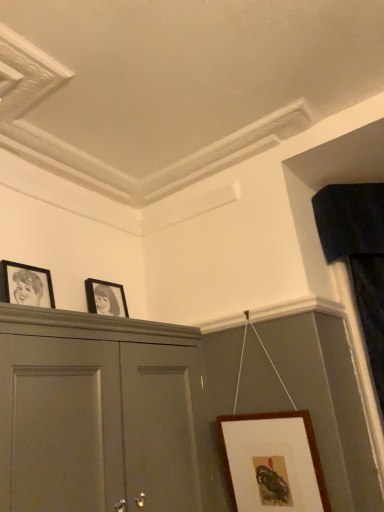
The height and width of the screenshot is (512, 384). I want to click on black matte picture frame at left, which ranks as the first picture frame in left-to-right order, so coord(27,285).

What do you see at coordinates (273, 462) in the screenshot? I see `brown wooden picture frame at lower right, which ranks as the 1th picture frame in bottom-to-top order` at bounding box center [273, 462].

Where is `black matte picture frame at left, which ranks as the third picture frame in bottom-to-top order`? black matte picture frame at left, which ranks as the third picture frame in bottom-to-top order is located at coordinates (27, 285).

Consider the image. How different are the orientations of velvet dark blue curtain at right and brown wooden picture frame at lower right, which ranks as the 1th picture frame in bottom-to-top order, in degrees?

They differ by 45 degrees in their facing directions.

Is velvet dark blue curtain at right outside of brown wooden picture frame at lower right, which ranks as the 1th picture frame in bottom-to-top order?

That's correct, velvet dark blue curtain at right is outside of brown wooden picture frame at lower right, which ranks as the 1th picture frame in bottom-to-top order.

From the image's perspective, which one is positioned lower, velvet dark blue curtain at right or brown wooden picture frame at lower right, the third picture frame when ordered from top to bottom?

brown wooden picture frame at lower right, the third picture frame when ordered from top to bottom, is shown below in the image.

Between velvet dark blue curtain at right and brown wooden picture frame at lower right, the third picture frame when ordered from top to bottom, which one has smaller size?

brown wooden picture frame at lower right, the third picture frame when ordered from top to bottom, is smaller.

Based on the photo, which object is positioned more to the left, brown wooden picture frame at lower right, which is the first picture frame in right-to-left order, or black matte picture frame at left, which ranks as the third picture frame in bottom-to-top order?

From the viewer's perspective, black matte picture frame at left, which ranks as the third picture frame in bottom-to-top order, appears more on the left side.

What are the coordinates of `the 2nd picture frame to the right of the black matte picture frame at left, placed as the 3th picture frame when sorted from right to left, counting from the anchor's position` in the screenshot? It's located at (273, 462).

Is brown wooden picture frame at lower right, which is the first picture frame in right-to-left order, touching black matte picture frame at left, which ranks as the first picture frame in left-to-right order?

They are not placed beside each other.

Is matte black picture frame at upper center, placed as the 2th picture frame when sorted from left to right, facing away from black matte picture frame at left, which ranks as the third picture frame in bottom-to-top order?

matte black picture frame at upper center, placed as the 2th picture frame when sorted from left to right, is not turned away from black matte picture frame at left, which ranks as the third picture frame in bottom-to-top order.

I want to click on picture frame above the matte black picture frame at upper center, the second picture frame from the top (from the image's perspective), so click(27, 285).

Is matte black picture frame at upper center, which is the 2th picture frame in bottom-to-top order, closer to the viewer compared to black matte picture frame at left, placed as the 3th picture frame when sorted from right to left?

That is False.

Does velvet dark blue curtain at right have a greater width compared to matte gray cabinet at upper left?

No.

Identify the location of cabinetry on the left side of velvet dark blue curtain at right. The height and width of the screenshot is (512, 384). (101, 415).

From the picture: Can you confirm if velvet dark blue curtain at right is positioned to the left of matte gray cabinet at upper left?

In fact, velvet dark blue curtain at right is to the right of matte gray cabinet at upper left.

Considering the points (124, 305) and (267, 479), which point is behind, point (124, 305) or point (267, 479)?

The point (124, 305) is behind.

Looking at this image, which of these two, matte black picture frame at upper center, the second picture frame from the top, or brown wooden picture frame at lower right, the third picture frame when ordered from top to bottom, stands taller?

Standing taller between the two is brown wooden picture frame at lower right, the third picture frame when ordered from top to bottom.

Who is bigger, matte black picture frame at upper center, which is counted as the 2th picture frame, starting from the right, or brown wooden picture frame at lower right, which is the first picture frame in right-to-left order?

brown wooden picture frame at lower right, which is the first picture frame in right-to-left order.

Considering the sizes of objects matte gray cabinet at upper left and matte black picture frame at upper center, the second picture frame from the top, in the image provided, who is wider, matte gray cabinet at upper left or matte black picture frame at upper center, the second picture frame from the top,?

Wider between the two is matte gray cabinet at upper left.

Considering the positions of points (37, 405) and (98, 290), is point (37, 405) farther from camera compared to point (98, 290)?

No, (37, 405) is in front of (98, 290).

In the scene shown: Choose the correct answer: Is matte gray cabinet at upper left inside matte black picture frame at upper center, the second picture frame from the top, or outside it?

matte gray cabinet at upper left is spatially situated outside matte black picture frame at upper center, the second picture frame from the top.

Is matte gray cabinet at upper left taller than matte black picture frame at upper center, placed as the 2th picture frame when sorted from left to right?

Yes.

Is brown wooden picture frame at lower right, which is the first picture frame in right-to-left order, to the right of matte gray cabinet at upper left from the viewer's perspective?

Yes, brown wooden picture frame at lower right, which is the first picture frame in right-to-left order, is to the right of matte gray cabinet at upper left.

Does brown wooden picture frame at lower right, which is the first picture frame in right-to-left order, lie behind matte gray cabinet at upper left?

That is True.

Consider the image. How different are the orientations of brown wooden picture frame at lower right, which ranks as the 1th picture frame in bottom-to-top order, and matte gray cabinet at upper left in degrees?

The facing directions of brown wooden picture frame at lower right, which ranks as the 1th picture frame in bottom-to-top order, and matte gray cabinet at upper left are 89.8 degrees apart.

Between point (291, 464) and point (158, 451), which one is positioned behind?

The point (291, 464) is behind.

Identify the location of curtain behind the brown wooden picture frame at lower right, which ranks as the 1th picture frame in bottom-to-top order. The image size is (384, 512). (358, 256).

Find the location of a particular element. Image resolution: width=384 pixels, height=512 pixels. the 2nd picture frame above the brown wooden picture frame at lower right, which is the first picture frame in right-to-left order (from the image's perspective) is located at coordinates (27, 285).

Looking at the image, which one is located closer to matte gray cabinet at upper left, velvet dark blue curtain at right or brown wooden picture frame at lower right, the 3th picture frame viewed from the left?

Based on the image, brown wooden picture frame at lower right, the 3th picture frame viewed from the left, appears to be nearer to matte gray cabinet at upper left.

Estimate the real-world distances between objects in this image. Which object is closer to brown wooden picture frame at lower right, which ranks as the 1th picture frame in bottom-to-top order, matte gray cabinet at upper left or matte black picture frame at upper center, placed as the 2th picture frame when sorted from left to right?

Based on the image, matte gray cabinet at upper left appears to be nearer to brown wooden picture frame at lower right, which ranks as the 1th picture frame in bottom-to-top order.

When comparing their distances from black matte picture frame at left, placed as the 3th picture frame when sorted from right to left, does velvet dark blue curtain at right or matte black picture frame at upper center, which is counted as the 2th picture frame, starting from the right, seem further?

velvet dark blue curtain at right.

Looking at the image, which one is located closer to matte gray cabinet at upper left, matte black picture frame at upper center, which is the 2th picture frame in bottom-to-top order, or velvet dark blue curtain at right?

matte black picture frame at upper center, which is the 2th picture frame in bottom-to-top order.

Looking at the image, which one is located further to black matte picture frame at left, acting as the 1th picture frame starting from the top, velvet dark blue curtain at right or brown wooden picture frame at lower right, which is the first picture frame in right-to-left order?

velvet dark blue curtain at right lies further to black matte picture frame at left, acting as the 1th picture frame starting from the top, than the other object.

When comparing their distances from black matte picture frame at left, acting as the 1th picture frame starting from the top, does matte black picture frame at upper center, which is the 2th picture frame in bottom-to-top order, or matte gray cabinet at upper left seem closer?

matte black picture frame at upper center, which is the 2th picture frame in bottom-to-top order.

Consider the image. When comparing their distances from black matte picture frame at left, acting as the 1th picture frame starting from the top, does velvet dark blue curtain at right or matte gray cabinet at upper left seem further?

velvet dark blue curtain at right is positioned further to the anchor black matte picture frame at left, acting as the 1th picture frame starting from the top.

When comparing their distances from brown wooden picture frame at lower right, the third picture frame when ordered from top to bottom, does velvet dark blue curtain at right or black matte picture frame at left, which ranks as the third picture frame in bottom-to-top order, seem further?

black matte picture frame at left, which ranks as the third picture frame in bottom-to-top order, is positioned further to the anchor brown wooden picture frame at lower right, the third picture frame when ordered from top to bottom.

Where is `picture frame between matte gray cabinet at upper left and velvet dark blue curtain at right from left to right`? Image resolution: width=384 pixels, height=512 pixels. picture frame between matte gray cabinet at upper left and velvet dark blue curtain at right from left to right is located at coordinates [x=273, y=462].

Where is `picture frame situated between black matte picture frame at left, acting as the 1th picture frame starting from the top, and brown wooden picture frame at lower right, the 3th picture frame viewed from the left, from left to right`? This screenshot has width=384, height=512. picture frame situated between black matte picture frame at left, acting as the 1th picture frame starting from the top, and brown wooden picture frame at lower right, the 3th picture frame viewed from the left, from left to right is located at coordinates (105, 298).

Locate an element on the screen. cabinetry located between black matte picture frame at left, acting as the 1th picture frame starting from the top, and velvet dark blue curtain at right in the left-right direction is located at coordinates (101, 415).

Locate an element on the screen. The height and width of the screenshot is (512, 384). picture frame between matte black picture frame at upper center, which is the 2th picture frame in bottom-to-top order, and velvet dark blue curtain at right from left to right is located at coordinates (273, 462).